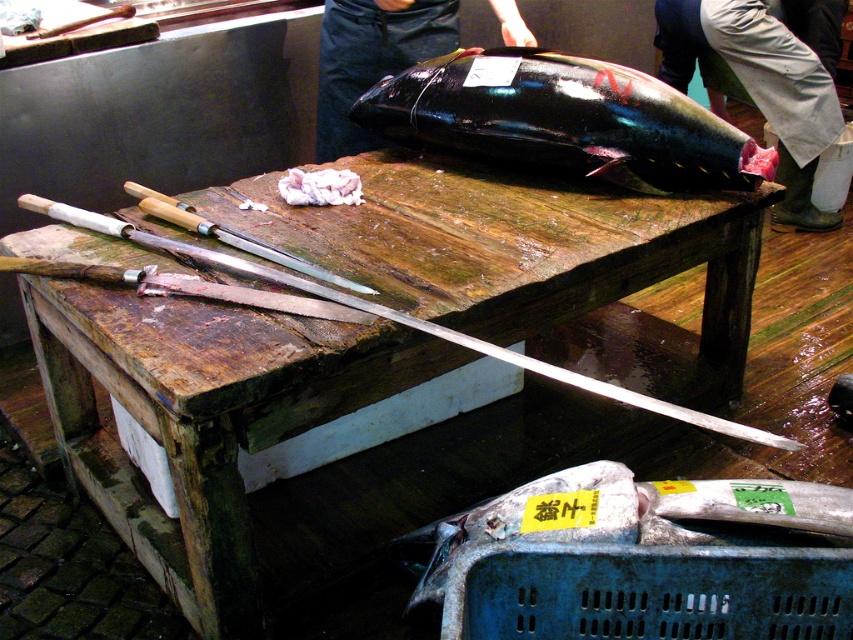
Question: Which object is the closest to the shiny black fish at center?

Choices:
 (A) wooden cutting board at center
 (B) glossy black fish at upper center

Answer: (B)

Question: Which point appears closest to the camera in this image?

Choices:
 (A) (57, 376)
 (B) (361, 92)
 (C) (570, 68)
 (D) (364, 288)

Answer: (D)

Question: Which of the following is the farthest from the observer?

Choices:
 (A) (418, 221)
 (B) (351, 129)
 (C) (219, 236)

Answer: (B)

Question: Does shiny black fish at center have a greater width compared to shiny metal knife at upper center?

Choices:
 (A) no
 (B) yes

Answer: (B)

Question: From the image, what is the correct spatial relationship of glossy black fish at upper center in relation to shiny metal knife at upper center?

Choices:
 (A) below
 (B) above

Answer: (B)

Question: Can you confirm if wooden cutting board at center is smaller than shiny black fish at center?

Choices:
 (A) yes
 (B) no

Answer: (B)